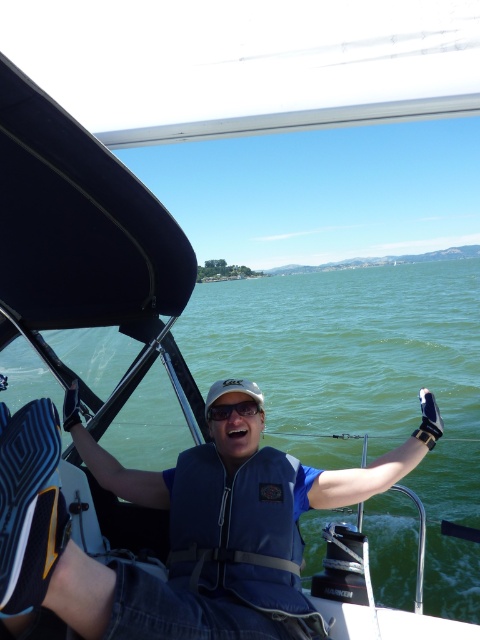
Can you confirm if blue fabric life jacket at center is smaller than matte black goggles at center?

Incorrect, blue fabric life jacket at center is not smaller in size than matte black goggles at center.

Is blue fabric life jacket at center taller than matte black goggles at center?

Correct, blue fabric life jacket at center is much taller as matte black goggles at center.

Is point (275, 605) farther from camera compared to point (219, 406)?

No, (275, 605) is in front of (219, 406).

This screenshot has width=480, height=640. In order to click on blue fabric life jacket at center in this screenshot , I will do 238,529.

Based on the photo, can you confirm if blue fabric life vest at center is positioned to the right of matte black goggles at center?

No, blue fabric life vest at center is not to the right of matte black goggles at center.

Does blue fabric life vest at center appear over matte black goggles at center?

Actually, blue fabric life vest at center is below matte black goggles at center.

Is point (96, 612) positioned behind point (252, 408)?

No, it is not.

Locate an element on the screen. This screenshot has height=640, width=480. blue fabric life vest at center is located at coordinates (173, 528).

The image size is (480, 640). What do you see at coordinates (173, 528) in the screenshot?
I see `blue fabric life vest at center` at bounding box center [173, 528].

Is blue fabric life vest at center bigger than blue fabric life jacket at center?

Yes.

Is point (103, 589) more distant than point (276, 484)?

No.

Identify the location of blue fabric life vest at center. This screenshot has height=640, width=480. (173, 528).